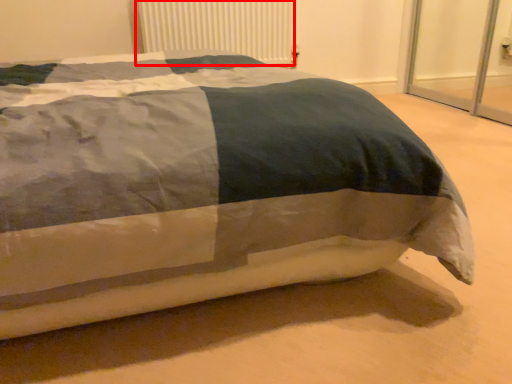
Question: In this image, where is radiator (annotated by the red box) located relative to bed?

Choices:
 (A) right
 (B) left

Answer: (B)